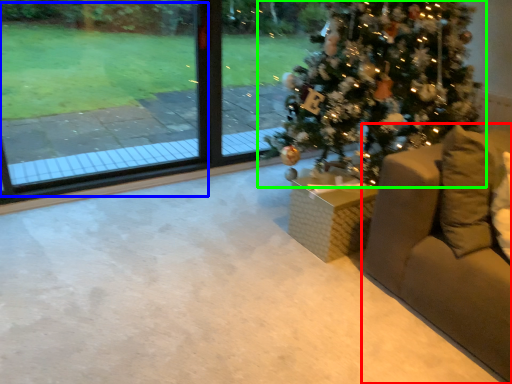
Question: Estimate the real-world distances between objects in this image. Which object is closer to furniture (highlighted by a red box), window screen (highlighted by a blue box) or christmas tree (highlighted by a green box)?

Choices:
 (A) window screen
 (B) christmas tree

Answer: (B)